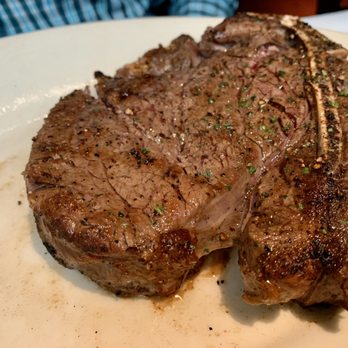
Find the location of `white plate`. white plate is located at coordinates (73, 320).